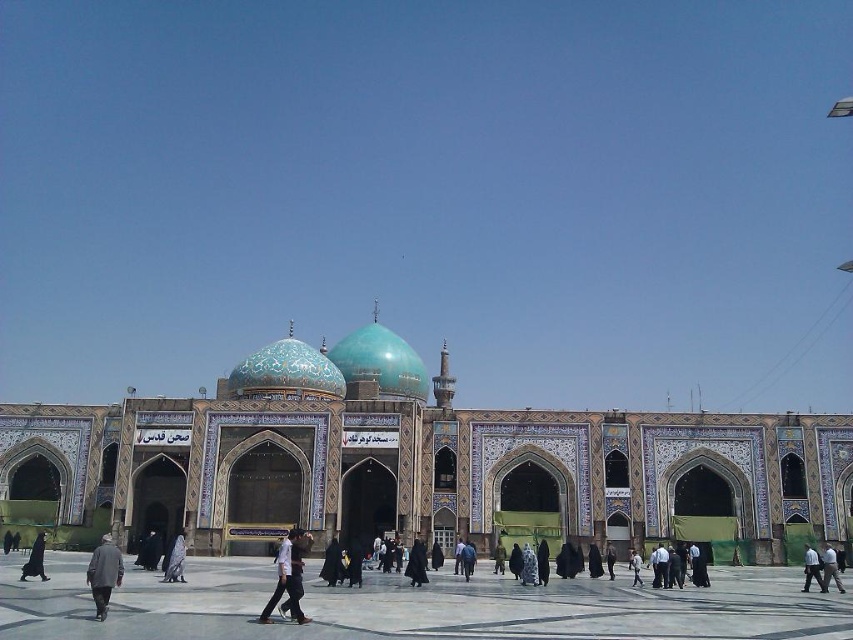
Does blue mosaic dome at center have a greater width compared to light gray fabric person at center?

Yes, blue mosaic dome at center is wider than light gray fabric person at center.

Between point (24, 442) and point (640, 584), which one is positioned behind?

The point (24, 442) is behind.

The image size is (853, 640). I want to click on blue mosaic dome at center, so click(422, 467).

Where is `blue mosaic dome at center`? This screenshot has width=853, height=640. blue mosaic dome at center is located at coordinates (422, 467).

Between blue mosaic dome at center and dark gray fabric person at center, which one is positioned higher?

blue mosaic dome at center is higher up.

You are a GUI agent. You are given a task and a screenshot of the screen. Output one action in this format:
    pyautogui.click(x=<x>, y=<y>)
    Task: Click on the blue mosaic dome at center
    
    Given the screenshot: What is the action you would take?
    pyautogui.click(x=422, y=467)

Does point (82, 461) come in front of point (808, 556)?

That is False.

Find the location of a particular element. The height and width of the screenshot is (640, 853). blue mosaic dome at center is located at coordinates (422, 467).

Who is lower down, white matte shirt at center or dark gray coat at lower left?

dark gray coat at lower left is lower down.

Is white matte shirt at center shorter than dark gray coat at lower left?

Correct, white matte shirt at center is not as tall as dark gray coat at lower left.

Does point (296, 596) come in front of point (108, 600)?

Yes.

Image resolution: width=853 pixels, height=640 pixels. What are the coordinates of `white matte shirt at center` in the screenshot? It's located at (288, 576).